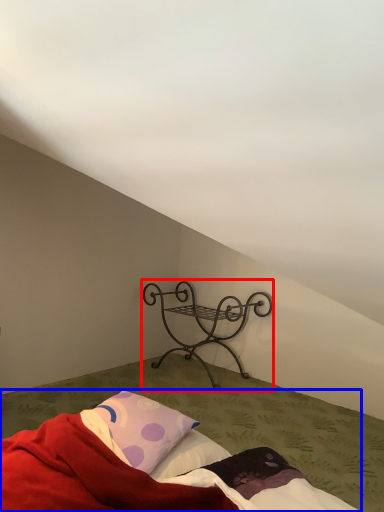
Question: Which point is further to the camera, furniture (highlighted by a red box) or bed (highlighted by a blue box)?

Choices:
 (A) furniture
 (B) bed

Answer: (A)